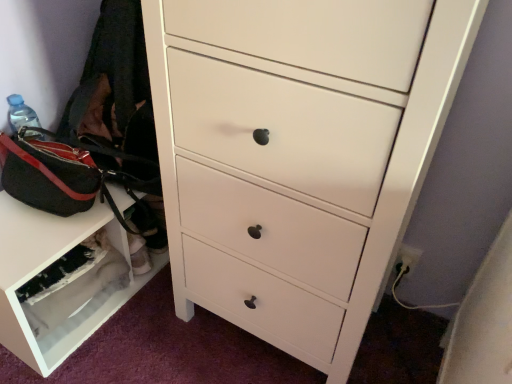
Question: Does white glossy chest of drawers at center have a greater height compared to white matte shoe rack at lower left?

Choices:
 (A) no
 (B) yes

Answer: (B)

Question: Is white glossy chest of drawers at center at the left side of white matte shoe rack at lower left?

Choices:
 (A) no
 (B) yes

Answer: (A)

Question: Is white glossy chest of drawers at center at the right side of white matte shoe rack at lower left?

Choices:
 (A) no
 (B) yes

Answer: (B)

Question: Does white glossy chest of drawers at center have a greater width compared to white matte shoe rack at lower left?

Choices:
 (A) yes
 (B) no

Answer: (A)

Question: Does white glossy chest of drawers at center have a lesser width compared to white matte shoe rack at lower left?

Choices:
 (A) no
 (B) yes

Answer: (A)

Question: Is white matte shoe rack at lower left wider or thinner than black canvas messenger bag at left?

Choices:
 (A) wide
 (B) thin

Answer: (B)

Question: Does point (94, 231) appear closer or farther from the camera than point (76, 167)?

Choices:
 (A) closer
 (B) farther

Answer: (B)

Question: Relative to black canvas messenger bag at left, is white matte shoe rack at lower left in front or behind?

Choices:
 (A) front
 (B) behind

Answer: (B)

Question: Would you say white matte shoe rack at lower left is to the left or to the right of black canvas messenger bag at left in the picture?

Choices:
 (A) right
 (B) left

Answer: (B)

Question: Considering the positions of black canvas messenger bag at left and white matte shoe rack at lower left in the image, is black canvas messenger bag at left bigger or smaller than white matte shoe rack at lower left?

Choices:
 (A) big
 (B) small

Answer: (A)

Question: From the image's perspective, relative to white matte shoe rack at lower left, is black canvas messenger bag at left above or below?

Choices:
 (A) below
 (B) above

Answer: (B)

Question: From a real-world perspective, is black canvas messenger bag at left positioned above or below white matte shoe rack at lower left?

Choices:
 (A) below
 (B) above

Answer: (B)

Question: From their relative heights in the image, would you say black canvas messenger bag at left is taller or shorter than white matte shoe rack at lower left?

Choices:
 (A) short
 (B) tall

Answer: (A)

Question: Visually, is white glossy chest of drawers at center positioned to the left or to the right of white matte shoe rack at lower left?

Choices:
 (A) right
 (B) left

Answer: (A)

Question: Is white glossy chest of drawers at center inside the boundaries of white matte shoe rack at lower left, or outside?

Choices:
 (A) outside
 (B) inside

Answer: (A)